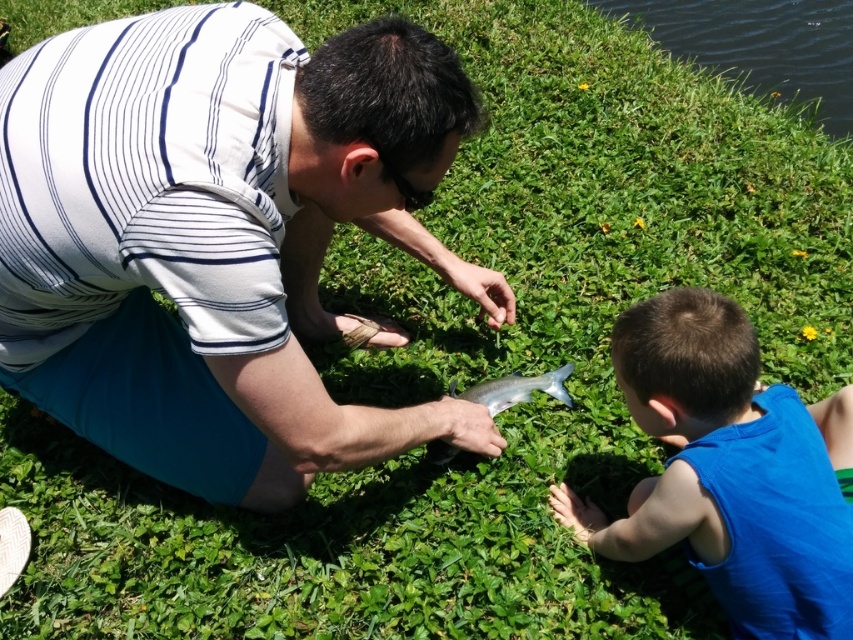
Does blue matte shirt at lower right have a greater width compared to green grassy water at upper right?

Incorrect, blue matte shirt at lower right's width does not surpass green grassy water at upper right's.

Does blue matte shirt at lower right have a lesser width compared to green grassy water at upper right?

Yes, blue matte shirt at lower right is thinner than green grassy water at upper right.

Is point (799, 595) positioned behind point (804, 10)?

No, it is in front of (804, 10).

At what (x,y) coordinates should I click in order to perform the action: click on blue matte shirt at lower right. Please return your answer as a coordinate pair (x, y). Image resolution: width=853 pixels, height=640 pixels. Looking at the image, I should click on (726, 472).

What do you see at coordinates (726, 472) in the screenshot? The image size is (853, 640). I see `blue matte shirt at lower right` at bounding box center [726, 472].

Between blue matte shirt at lower right and shiny metallic fish at center, which one is positioned higher?

shiny metallic fish at center is higher up.

Is point (705, 477) closer to viewer compared to point (444, 452)?

That is True.

The height and width of the screenshot is (640, 853). Identify the location of blue matte shirt at lower right. click(x=726, y=472).

Is matte white shirt at center thinner than green grassy water at upper right?

Yes, matte white shirt at center is thinner than green grassy water at upper right.

Does point (91, 54) come behind point (715, 49)?

That is False.

Locate an element on the screen. matte white shirt at center is located at coordinates (219, 234).